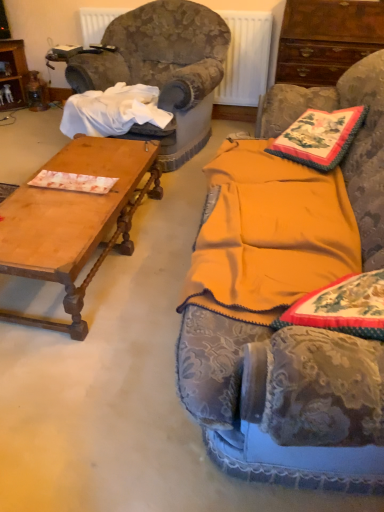
The height and width of the screenshot is (512, 384). Find the location of `vacant area that lies between velvet fabric couch at center and wooden polished coffee table at left`. vacant area that lies between velvet fabric couch at center and wooden polished coffee table at left is located at coordinates (135, 309).